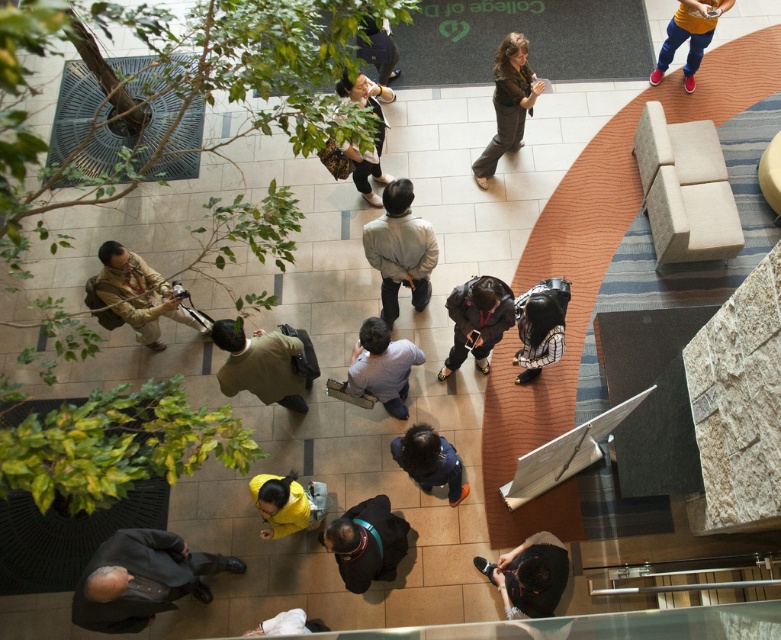
Question: Based on their relative distances, which object is nearer to the matte black jacket at center?

Choices:
 (A) dark gray sweater at lower center
 (B) orange cotton shirt at upper right

Answer: (B)

Question: Does light brown leather jacket at center have a lesser width compared to dark gray fabric jacket at center?

Choices:
 (A) yes
 (B) no

Answer: (B)

Question: Which object is closer to the camera taking this photo?

Choices:
 (A) yellow matte jacket at center
 (B) black leather jacket at center
 (C) dark gray sweater at lower center
 (D) dark gray jacket at lower left

Answer: (D)

Question: From the image, what is the correct spatial relationship of dark gray fabric jacket at center in relation to white fabric at lower center?

Choices:
 (A) right
 (B) left

Answer: (A)

Question: Can you confirm if light gray fabric jacket at center is smaller than orange cotton shirt at upper right?

Choices:
 (A) yes
 (B) no

Answer: (B)

Question: Which of the following is the closest to the observer?

Choices:
 (A) matte black jacket at center
 (B) dark brown leather jacket at center

Answer: (A)